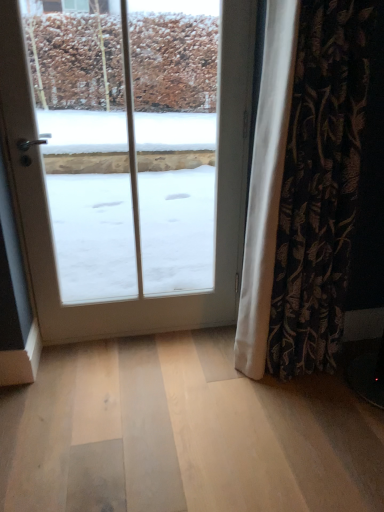
Locate an element on the screen. The width and height of the screenshot is (384, 512). white glass door at center is located at coordinates [47, 208].

This screenshot has height=512, width=384. What do you see at coordinates (47, 208) in the screenshot?
I see `white glass door at center` at bounding box center [47, 208].

In order to face white glass door at center, should I rotate leftwards or rightwards?

To face it directly, rotate left by 7.779 degrees.

You are a GUI agent. You are given a task and a screenshot of the screen. Output one action in this format:
    pyautogui.click(x=<x>, y=<y>)
    Task: Click on the black floral fabric curtain at right
    
    Given the screenshot: What is the action you would take?
    pyautogui.click(x=330, y=186)

The image size is (384, 512). Describe the element at coordinates (330, 186) in the screenshot. I see `black floral fabric curtain at right` at that location.

What are the coordinates of `white glass door at center` in the screenshot? It's located at (47, 208).

Which is more to the right, black floral fabric curtain at right or white glass door at center?

black floral fabric curtain at right.

Which object is closer to the camera, black floral fabric curtain at right or white glass door at center?

black floral fabric curtain at right.

Is point (355, 87) closer to camera compared to point (142, 330)?

Yes, it is in front of point (142, 330).

From the image's perspective, does black floral fabric curtain at right appear lower than white glass door at center?

Indeed, from the image's perspective, black floral fabric curtain at right is shown beneath white glass door at center.

From a real-world perspective, is black floral fabric curtain at right physically above white glass door at center?

No, from a real-world perspective, black floral fabric curtain at right is not over white glass door at center

Which of these two, black floral fabric curtain at right or white glass door at center, is thinner?

With smaller width is white glass door at center.

Considering the relative sizes of black floral fabric curtain at right and white glass door at center in the image provided, is black floral fabric curtain at right shorter than white glass door at center?

Indeed, black floral fabric curtain at right has a lesser height compared to white glass door at center.

Considering the sizes of objects black floral fabric curtain at right and white glass door at center in the image provided, who is bigger, black floral fabric curtain at right or white glass door at center?

black floral fabric curtain at right.

Is black floral fabric curtain at right spatially inside white glass door at center, or outside of it?

black floral fabric curtain at right is outside white glass door at center.

Is the surface of black floral fabric curtain at right in direct contact with white glass door at center?

black floral fabric curtain at right and white glass door at center are not in contact.

Could you tell me if black floral fabric curtain at right is turned towards white glass door at center?

No, black floral fabric curtain at right does not turn towards white glass door at center.

This screenshot has height=512, width=384. Identify the location of curtain in front of the white glass door at center. (330, 186).

Is white glass door at center to the left of black floral fabric curtain at right from the viewer's perspective?

Yes.

Is white glass door at center further to camera compared to black floral fabric curtain at right?

Yes, white glass door at center is further from the camera.

Which is nearer, (18, 170) or (321, 214)?

The point (321, 214) is in front.

From the image's perspective, between white glass door at center and black floral fabric curtain at right, who is located below?

black floral fabric curtain at right is shown below in the image.

From a real-world perspective, is white glass door at center positioned under black floral fabric curtain at right based on gravity?

Incorrect, from a real-world perspective, white glass door at center is higher than black floral fabric curtain at right.

Between white glass door at center and black floral fabric curtain at right, which one has smaller width?

Thinner between the two is white glass door at center.

In terms of height, does white glass door at center look taller or shorter compared to black floral fabric curtain at right?

Clearly, white glass door at center is taller compared to black floral fabric curtain at right.

Considering the sizes of objects white glass door at center and black floral fabric curtain at right in the image provided, who is smaller, white glass door at center or black floral fabric curtain at right?

With smaller size is white glass door at center.

Can black floral fabric curtain at right be found inside white glass door at center?

No, black floral fabric curtain at right is not a part of white glass door at center.

Is white glass door at center beside black floral fabric curtain at right?

No, white glass door at center is not next to black floral fabric curtain at right.

Is white glass door at center turned away from black floral fabric curtain at right?

No, white glass door at center is not facing away from black floral fabric curtain at right.

Where is `curtain that is below the white glass door at center (from the image's perspective)`? The image size is (384, 512). curtain that is below the white glass door at center (from the image's perspective) is located at coordinates (330, 186).

Find the location of a particular element. This screenshot has height=512, width=384. door above the black floral fabric curtain at right (from the image's perspective) is located at coordinates (47, 208).

What are the coordinates of `door above the black floral fabric curtain at right (from a real-world perspective)` in the screenshot? It's located at (47, 208).